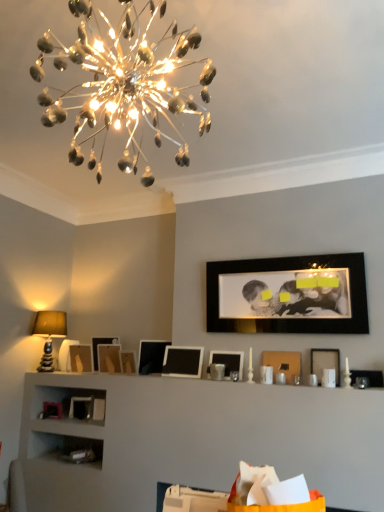
Locate an element on the screen. matte black picture frame at lower left, the tenth picture frame in the right-to-left sequence is located at coordinates 81,408.

Measure the distance between point (43, 410) and camera.

The depth of point (43, 410) is 12.77 feet.

What do you see at coordinates (128, 362) in the screenshot? The height and width of the screenshot is (512, 384). I see `wooden picture frame at center, the 8th picture frame from the right` at bounding box center [128, 362].

Measure the distance between black glossy picture frame at upper center, the third picture frame in the right-to-left sequence, and camera.

black glossy picture frame at upper center, the third picture frame in the right-to-left sequence, is 3.14 meters away from camera.

Describe the element at coordinates (289, 295) in the screenshot. I see `black glossy picture frame at upper center, the third picture frame in the right-to-left sequence` at that location.

This screenshot has height=512, width=384. I want to click on matte black picture frame at center, which is the 8th picture frame from left to right, so click(x=228, y=361).

How distant is matte black picture frame at center, positioned as the 6th picture frame in left-to-right order, from matte black picture frame at center right, positioned as the 2th picture frame in right-to-left order?

matte black picture frame at center, positioned as the 6th picture frame in left-to-right order, and matte black picture frame at center right, positioned as the 2th picture frame in right-to-left order, are 1.38 meters apart from each other.

There is a matte black picture frame at center right, the 11th picture frame positioned from the left. Where is `the 4th picture frame above it (from a real-world perspective)`? the 4th picture frame above it (from a real-world perspective) is located at coordinates (151, 356).

Is matte black picture frame at center, positioned as the 6th picture frame in left-to-right order, facing towards matte black picture frame at center right, positioned as the 2th picture frame in right-to-left order?

No, matte black picture frame at center, positioned as the 6th picture frame in left-to-right order, is not facing towards matte black picture frame at center right, positioned as the 2th picture frame in right-to-left order.

What's the angular difference between matte black picture frame at center, positioned as the 6th picture frame in left-to-right order, and matte black picture frame at center right, positioned as the 2th picture frame in right-to-left order,'s facing directions?

matte black picture frame at center, positioned as the 6th picture frame in left-to-right order, and matte black picture frame at center right, positioned as the 2th picture frame in right-to-left order, are facing 39.6 degrees away from each other.

Which is behind, point (45, 312) or point (117, 340)?

The point (117, 340) is farther.

In the image, is matte beige lampshade at left positioned in front of or behind matte wooden picture frame at center, which is counted as the ninth picture frame, starting from the right?

matte beige lampshade at left is positioned farther from the viewer than matte wooden picture frame at center, which is counted as the ninth picture frame, starting from the right.

Between matte beige lampshade at left and matte wooden picture frame at center, which appears as the fourth picture frame when viewed from the left, which one appears on the right side from the viewer's perspective?

matte wooden picture frame at center, which appears as the fourth picture frame when viewed from the left.

Is matte beige lampshade at left with matte wooden picture frame at center, which appears as the fourth picture frame when viewed from the left?

matte beige lampshade at left is not next to matte wooden picture frame at center, which appears as the fourth picture frame when viewed from the left, and they're not touching.

From the image's perspective, which object appears higher, matte black picture frame at center, placed as the 5th picture frame when sorted from right to left, or matte black picture frame at center right, the 11th picture frame positioned from the left?

matte black picture frame at center right, the 11th picture frame positioned from the left.

From a real-world perspective, is matte black picture frame at center, placed as the 5th picture frame when sorted from right to left, located higher than matte black picture frame at center right, positioned as the 2th picture frame in right-to-left order?

No, from a real-world perspective, matte black picture frame at center, placed as the 5th picture frame when sorted from right to left, is not on top of matte black picture frame at center right, positioned as the 2th picture frame in right-to-left order.

Is matte black picture frame at center right, the 11th picture frame positioned from the left, at the back of matte black picture frame at center, placed as the 5th picture frame when sorted from right to left?

No, matte black picture frame at center, placed as the 5th picture frame when sorted from right to left, is not facing the opposite direction of matte black picture frame at center right, the 11th picture frame positioned from the left.

Does point (46, 361) appear closer or farther from the camera than point (368, 374)?

Point (46, 361) is positioned farther from the camera compared to point (368, 374).

Considering the positions of objects matte beige lampshade at left and matte black picture frame at right, placed as the first picture frame when sorted from right to left, in the image provided, who is behind, matte beige lampshade at left or matte black picture frame at right, placed as the first picture frame when sorted from right to left,?

Positioned behind is matte beige lampshade at left.

Would you say matte beige lampshade at left is outside matte black picture frame at right, placed as the first picture frame when sorted from right to left?

Yes, matte beige lampshade at left is outside of matte black picture frame at right, placed as the first picture frame when sorted from right to left.

Does point (124, 361) appear closer or farther from the camera than point (61, 326)?

Point (124, 361) is positioned closer to the camera compared to point (61, 326).

From a real-world perspective, who is located lower, wooden picture frame at center, the 8th picture frame from the right, or matte beige lampshade at left?

From a 3D spatial view, wooden picture frame at center, the 8th picture frame from the right, is below.

Find the location of a particular element. The image size is (384, 512). the 5th picture frame counting from the right side of the matte beige lampshade at left is located at coordinates (128, 362).

Is wooden picture frame at center, the 8th picture frame from the right, oriented away from matte beige lampshade at left?

No, wooden picture frame at center, the 8th picture frame from the right, is not facing away from matte beige lampshade at left.

Who is more distant, matte black picture frame at lower left, the third picture frame viewed from the left, or black matte picture frame at center, which is the 6th picture frame from right to left?

matte black picture frame at lower left, the third picture frame viewed from the left, is behind.

Considering the positions of objects matte black picture frame at lower left, the third picture frame viewed from the left, and black matte picture frame at center, arranged as the 7th picture frame when viewed from the left, in the image provided, who is more to the left, matte black picture frame at lower left, the third picture frame viewed from the left, or black matte picture frame at center, arranged as the 7th picture frame when viewed from the left,?

matte black picture frame at lower left, the third picture frame viewed from the left.

From a real-world perspective, who is located higher, matte black picture frame at lower left, the third picture frame viewed from the left, or black matte picture frame at center, arranged as the 7th picture frame when viewed from the left?

In real-world perspective, black matte picture frame at center, arranged as the 7th picture frame when viewed from the left, is above.

Consider the image. Considering the sizes of matte black picture frame at lower left, the third picture frame viewed from the left, and black matte picture frame at center, arranged as the 7th picture frame when viewed from the left, in the image, is matte black picture frame at lower left, the third picture frame viewed from the left, taller or shorter than black matte picture frame at center, arranged as the 7th picture frame when viewed from the left,?

Considering their sizes, matte black picture frame at lower left, the third picture frame viewed from the left, has less height than black matte picture frame at center, arranged as the 7th picture frame when viewed from the left.

Considering the relative positions of matte black picture frame at center right, positioned as the 2th picture frame in right-to-left order, and matte black picture frame at right, which appears as the twelfth picture frame when viewed from the left, in the image provided, is matte black picture frame at center right, positioned as the 2th picture frame in right-to-left order, behind matte black picture frame at right, which appears as the twelfth picture frame when viewed from the left,?

Yes, it is behind matte black picture frame at right, which appears as the twelfth picture frame when viewed from the left.

Consider the image. Is matte black picture frame at center right, the 11th picture frame positioned from the left, far away from matte black picture frame at right, placed as the first picture frame when sorted from right to left?

matte black picture frame at center right, the 11th picture frame positioned from the left, is near matte black picture frame at right, placed as the first picture frame when sorted from right to left, not far away.

Considering the positions of objects matte black picture frame at center right, the 11th picture frame positioned from the left, and matte black picture frame at right, placed as the first picture frame when sorted from right to left, in the image provided, who is more to the left, matte black picture frame at center right, the 11th picture frame positioned from the left, or matte black picture frame at right, placed as the first picture frame when sorted from right to left,?

Positioned to the left is matte black picture frame at center right, the 11th picture frame positioned from the left.

Considering the positions of point (313, 352) and point (374, 372), is point (313, 352) closer or farther from the camera than point (374, 372)?

Clearly, point (313, 352) is more distant from the camera than point (374, 372).

You are a GUI agent. You are given a task and a screenshot of the screen. Output one action in this format:
    pyautogui.click(x=<x>, y=<y>)
    Task: Click on the 5th picture frame behind the matte black picture frame at center right, positioned as the 2th picture frame in right-to-left order, starting your count from the anchor
    Image resolution: width=384 pixels, height=512 pixels.
    Given the screenshot: What is the action you would take?
    pyautogui.click(x=151, y=356)

At what (x,y) coordinates should I click in order to perform the action: click on picture frame that is the 1st object located in front of the matte beige lampshade at left. Please return your answer as a coordinate pair (x, y). Image resolution: width=384 pixels, height=512 pixels. Looking at the image, I should click on (101, 343).

Consider the image. Which object lies further to the anchor point black glossy picture frame at upper center, the third picture frame in the right-to-left sequence, matte black picture frame at lower left, the tenth picture frame in the right-to-left sequence, or black matte picture frame at center, arranged as the 7th picture frame when viewed from the left?

matte black picture frame at lower left, the tenth picture frame in the right-to-left sequence, lies further to black glossy picture frame at upper center, the third picture frame in the right-to-left sequence, than the other object.

Considering their positions, is matte wooden picture frame at center, which is counted as the ninth picture frame, starting from the right, positioned further to wooden picture frame at center, the 8th picture frame from the right, than black matte picture frame at center, arranged as the 7th picture frame when viewed from the left?

Based on the image, black matte picture frame at center, arranged as the 7th picture frame when viewed from the left, appears to be further to wooden picture frame at center, the 8th picture frame from the right.

Estimate the real-world distances between objects in this image. Which object is further from shiny metallic chandelier at upper center, matte black picture frame at center, placed as the 5th picture frame when sorted from right to left, or matte black picture frame at center, positioned as the 6th picture frame in left-to-right order?

matte black picture frame at center, positioned as the 6th picture frame in left-to-right order, lies further to shiny metallic chandelier at upper center than the other object.

Estimate the real-world distances between objects in this image. Which object is closer to matte beige lampshade at left, matte black picture frame at lower left, the tenth picture frame in the right-to-left sequence, or matte black picture frame at right, placed as the first picture frame when sorted from right to left?

Based on the image, matte black picture frame at lower left, the tenth picture frame in the right-to-left sequence, appears to be nearer to matte beige lampshade at left.

Which object lies further to the anchor point wooden picture frame at center, the 8th picture frame from the right, black glossy picture frame at upper center, the third picture frame in the right-to-left sequence, or matte black picture frame at center, positioned as the 6th picture frame in left-to-right order?

black glossy picture frame at upper center, the third picture frame in the right-to-left sequence, lies further to wooden picture frame at center, the 8th picture frame from the right, than the other object.

Based on their spatial positions, is matte black picture frame at center, which is the fourth picture frame from right to left, or matte black picture frame at lower left, the first picture frame positioned from the left, further from black matte picture frame at center, which is the 6th picture frame from right to left?

matte black picture frame at lower left, the first picture frame positioned from the left.

Based on their spatial positions, is matte black picture frame at right, which appears as the twelfth picture frame when viewed from the left, or matte black picture frame at center, positioned as the 6th picture frame in left-to-right order, closer to matte black picture frame at lower left, the twelfth picture frame from the right?

matte black picture frame at center, positioned as the 6th picture frame in left-to-right order.

Which object lies nearer to the anchor point wooden picture frame at center, which ranks as the 5th picture frame in left-to-right order, shiny metallic chandelier at upper center or matte black picture frame at lower left, the twelfth picture frame from the right?

matte black picture frame at lower left, the twelfth picture frame from the right, is positioned closer to the anchor wooden picture frame at center, which ranks as the 5th picture frame in left-to-right order.

At what (x,y) coordinates should I click in order to perform the action: click on picture frame between black glossy picture frame at upper center, the third picture frame in the right-to-left sequence, and matte black picture frame at center, which is counted as the ninth picture frame, starting from the left, in the up-down direction. Please return your answer as a coordinate pair (x, y). Image resolution: width=384 pixels, height=512 pixels. Looking at the image, I should click on (325, 362).

This screenshot has width=384, height=512. Identify the location of picture frame between matte wooden picture frame at left, marked as the 2th picture frame in a left-to-right arrangement, and matte black picture frame at lower left, the third picture frame viewed from the left, vertically. coord(52,410).

Identify the location of table lamp between shiny metallic chandelier at upper center and matte black picture frame at lower left, the twelfth picture frame from the right, along the z-axis. This screenshot has width=384, height=512. (49, 334).

Find the location of `picture frame located between matte wooden picture frame at center, which appears as the fourth picture frame when viewed from the left, and matte black picture frame at center, positioned as the 6th picture frame in left-to-right order, in the left-right direction`. picture frame located between matte wooden picture frame at center, which appears as the fourth picture frame when viewed from the left, and matte black picture frame at center, positioned as the 6th picture frame in left-to-right order, in the left-right direction is located at coordinates (128, 362).